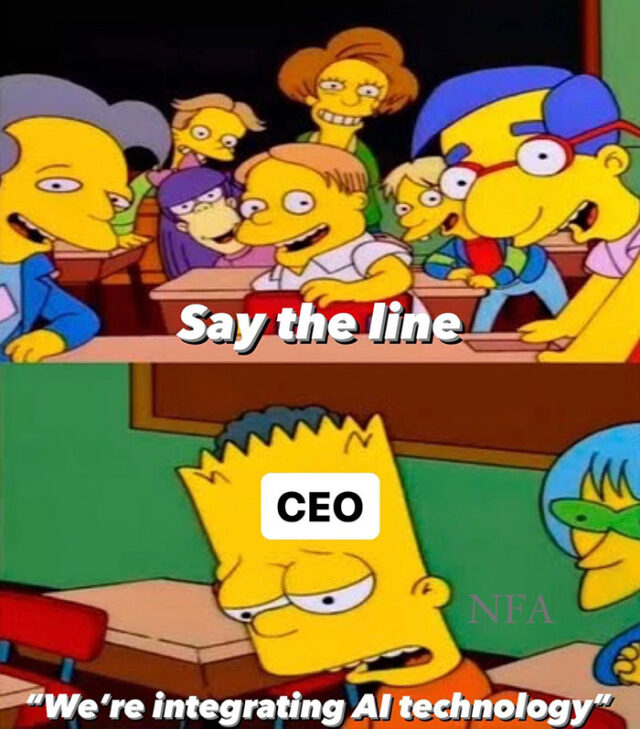
In order to click on frames in this screenshot , I will do `click(134, 539)`, `click(288, 160)`.